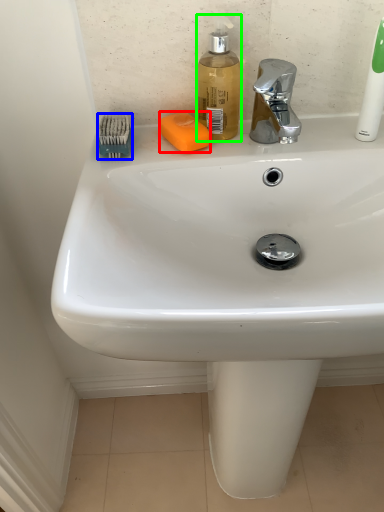
Question: Which is farther away from soap (highlighted by a red box)? brush (highlighted by a blue box) or soap dispenser (highlighted by a green box)?

Choices:
 (A) brush
 (B) soap dispenser

Answer: (A)